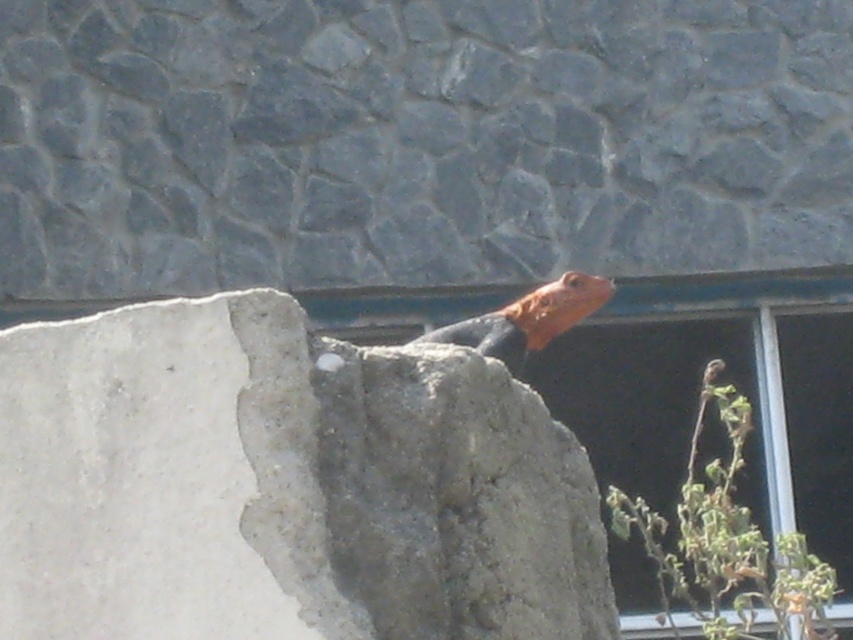
You are standing in front of the scene and want to locate the gray concrete rock at center. What are the coordinates where you should look?

The gray concrete rock at center is located at coordinates point [283,484].

Based on the photo, you are standing in front of the scene and want to determine which of the two points, point (x=74, y=614) or point (x=524, y=358), is nearer to you. Based on the image, which point is closer?

Point (x=74, y=614) is closer to the viewer than point (x=524, y=358).